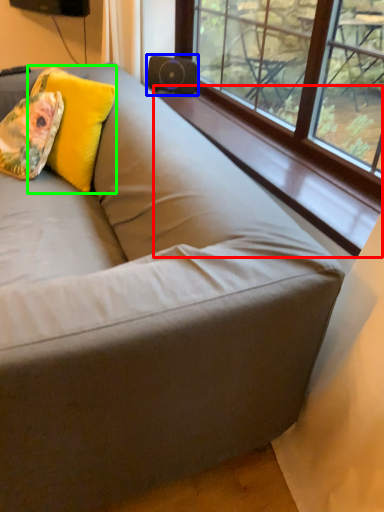
Question: Considering the real-world distances, which object is closest to window sill (highlighted by a red box)? speaker (highlighted by a blue box) or throw pillow (highlighted by a green box).

Choices:
 (A) speaker
 (B) throw pillow

Answer: (A)